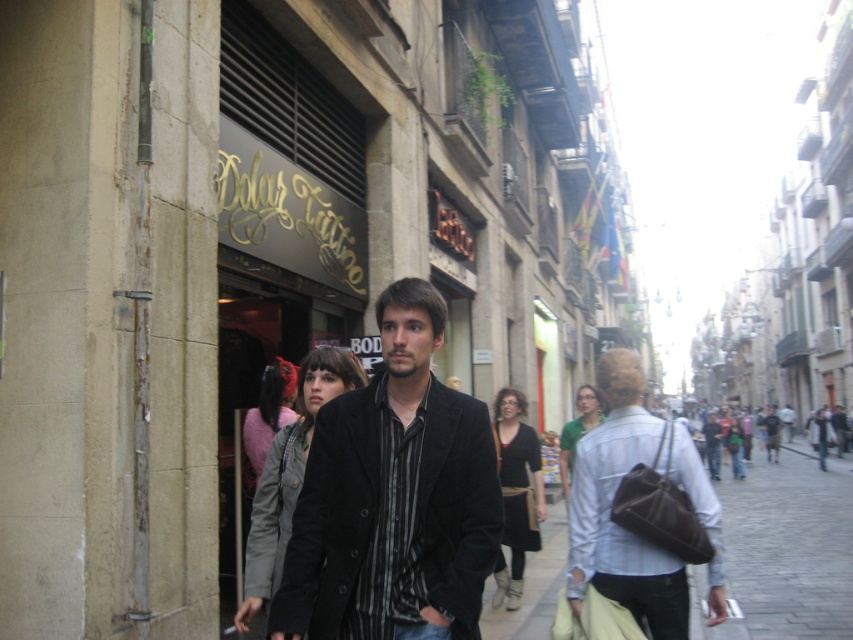
You are a delivery person who needs to pick up a package from a brown leather bag at lower right. If your reach extends 1.5 meters, can you grab it without moving closer?

The brown leather bag at lower right is 4.64 meters away from the camera, which is farther than your 1.5 meter reach. You need to move closer to grab it.

You are a fashion designer observing the scene. You need to determine which item is taller between the black matte coat at center and the brown leather bag at lower right. Which one is taller?

The brown leather bag at lower right is taller because the black matte coat at center is shorter than it.

You are a photographer standing in the middle of the street. You see a man wearing a light blue denim shirt at center and a woman wearing a gray matte jacket at center. Which clothing item is positioned to the right?

The light blue denim shirt at center is positioned to the right of the gray matte jacket at center.